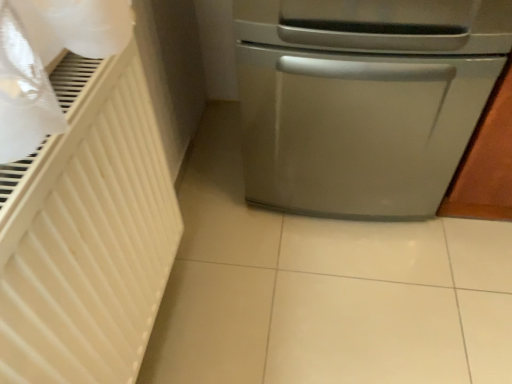
Question: From a real-world perspective, is white matte radiator at left beneath satin silver dishwasher at right?

Choices:
 (A) yes
 (B) no

Answer: (B)

Question: Is white matte radiator at left to the right of satin silver dishwasher at right from the viewer's perspective?

Choices:
 (A) yes
 (B) no

Answer: (B)

Question: Is satin silver dishwasher at right surrounded by white matte radiator at left?

Choices:
 (A) yes
 (B) no

Answer: (B)

Question: Is white matte radiator at left shorter than satin silver dishwasher at right?

Choices:
 (A) no
 (B) yes

Answer: (B)

Question: Is white matte radiator at left next to satin silver dishwasher at right and touching it?

Choices:
 (A) yes
 (B) no

Answer: (B)

Question: Is white matte radiator at left outside of satin silver dishwasher at right?

Choices:
 (A) no
 (B) yes

Answer: (B)

Question: Is the position of satin silver dishwasher at right less distant than that of white matte radiator at left?

Choices:
 (A) yes
 (B) no

Answer: (B)

Question: From a real-world perspective, is satin silver dishwasher at right located beneath white matte radiator at left?

Choices:
 (A) yes
 (B) no

Answer: (A)

Question: Does satin silver dishwasher at right touch white matte radiator at left?

Choices:
 (A) yes
 (B) no

Answer: (B)

Question: Does satin silver dishwasher at right appear on the left side of white matte radiator at left?

Choices:
 (A) no
 (B) yes

Answer: (A)

Question: Would you say satin silver dishwasher at right is outside white matte radiator at left?

Choices:
 (A) no
 (B) yes

Answer: (B)

Question: Is satin silver dishwasher at right looking in the opposite direction of white matte radiator at left?

Choices:
 (A) yes
 (B) no

Answer: (B)

Question: Considering the relative positions of white matte radiator at left and satin silver dishwasher at right in the image provided, is white matte radiator at left to the left or to the right of satin silver dishwasher at right?

Choices:
 (A) right
 (B) left

Answer: (B)